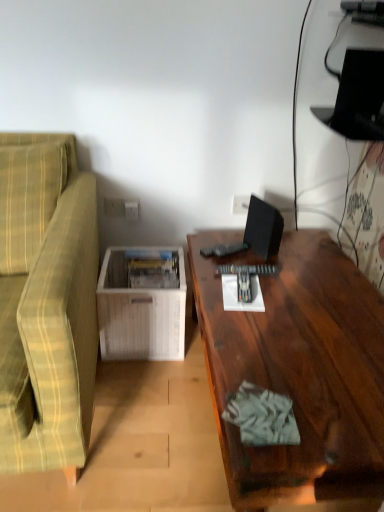
Where is `free region on the left part of black matte computer monitor at upper right`? The image size is (384, 512). free region on the left part of black matte computer monitor at upper right is located at coordinates (219, 246).